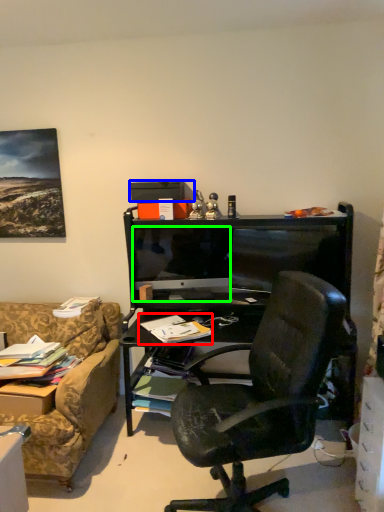
Question: Estimate the real-world distances between objects in this image. Which object is closer to book (highlighted by a red box), box (highlighted by a blue box) or television (highlighted by a green box)?

Choices:
 (A) box
 (B) television

Answer: (B)